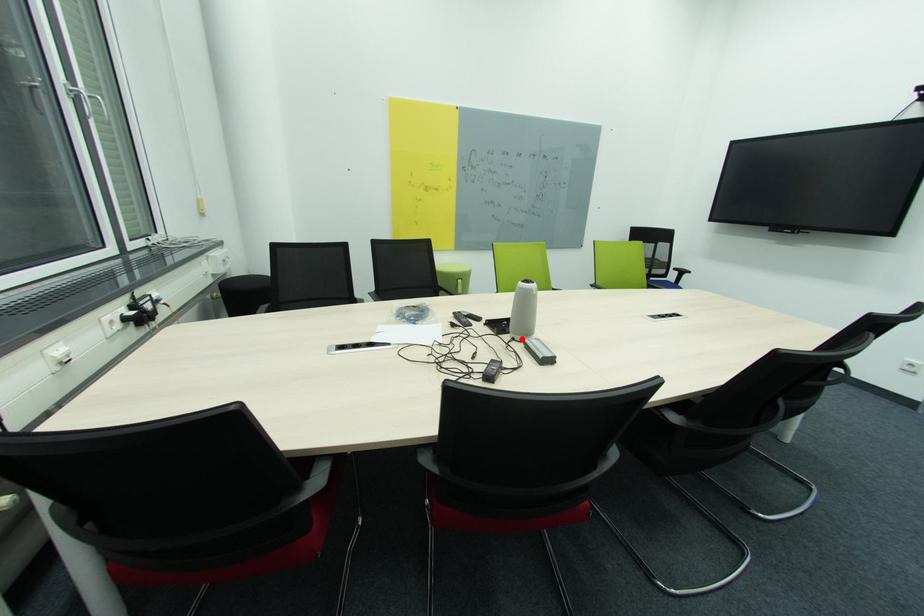
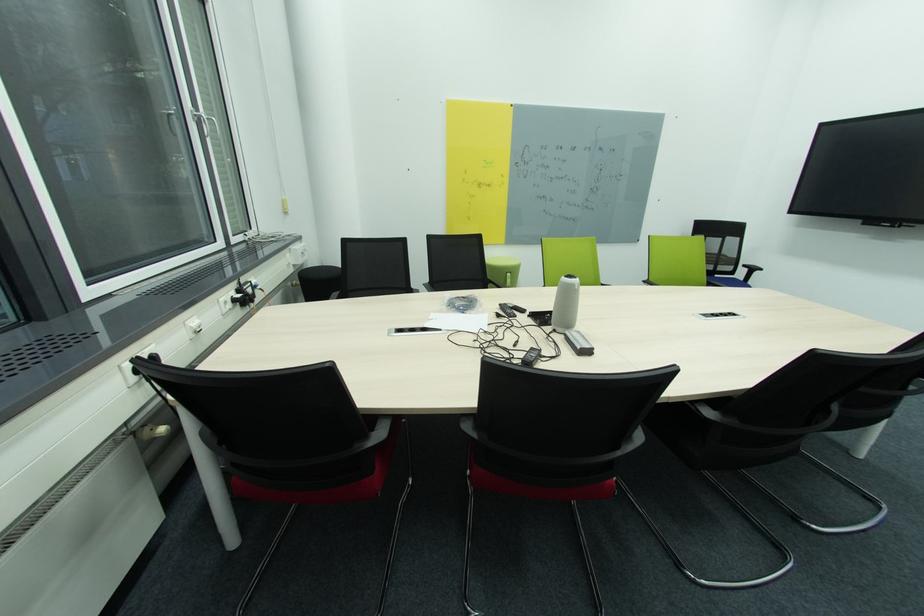
In the second image, find the point that corresponds to the highlighted location in the first image.

(563, 331)